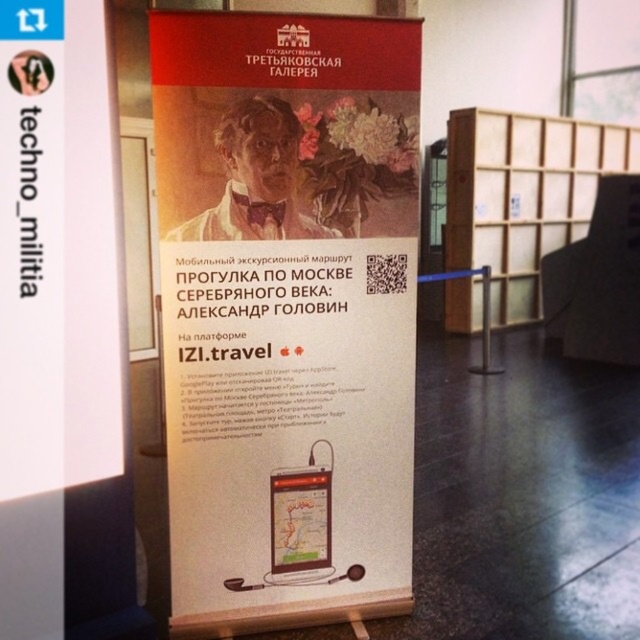
You are at an exhibition and need to locate the QR code for the mobile tour app. The QR code is on the white paper poster at center. If you are currently facing the wooden at right, which direction should you turn to find the QR code?

Since the white paper poster at center is to the left of wooden at right, you should turn to your left to face the white paper poster at center and locate the QR code.

You are at the Tretyakov Gallery and want to check the height of the white paper poster at center and the wooden at right to see if they can fit on your 1.5 meter tall display stand. Which one is shorter?

The white paper poster at center is shorter than wooden at right, so the white paper poster at center can fit on the 1.5 meter tall display stand.

You are standing 2 meters away from the promotional banner at the Tretyakov Gallery. There is a point at coordinates point (209, 72) on the banner. Can you reach this point without moving closer to the banner?

The distance of point (209, 72) from viewer is 1.59 meters. Since you are currently 2 meters away, you cannot reach the point as it is closer to you than your current position.